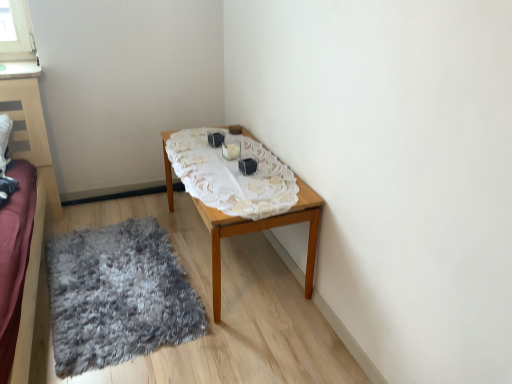
Identify the location of free area below gray shaggy rug at lower left (from a real-world perspective). (116, 256).